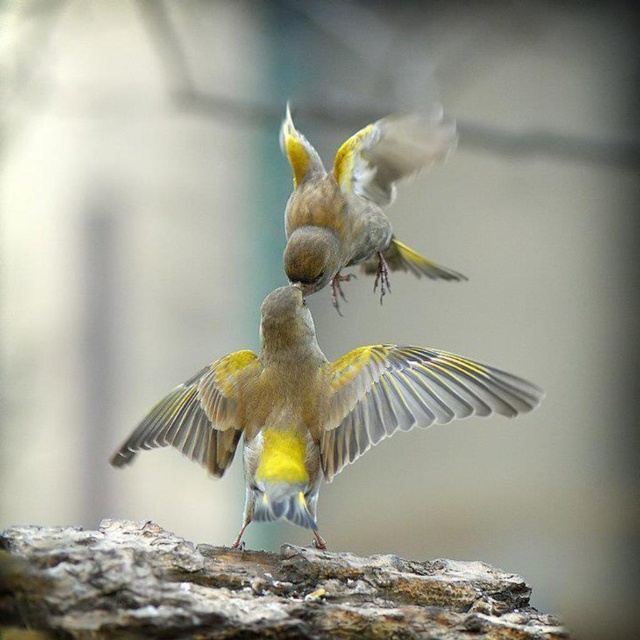
Question: Does yellow-green feathers at center appear on the right side of golden textured bird at center?

Choices:
 (A) no
 (B) yes

Answer: (A)

Question: Among these objects, which one is nearest to the camera?

Choices:
 (A) golden textured bird at center
 (B) yellow-green feathers at center

Answer: (B)

Question: Is yellow-green feathers at center thinner than golden textured bird at center?

Choices:
 (A) yes
 (B) no

Answer: (B)

Question: Among these points, which one is nearest to the camera?

Choices:
 (A) (387, 227)
 (B) (296, 388)

Answer: (B)

Question: Which object is farther from the camera taking this photo?

Choices:
 (A) yellow-green feathers at center
 (B) golden textured bird at center

Answer: (B)

Question: Can you confirm if yellow-green feathers at center is positioned to the left of golden textured bird at center?

Choices:
 (A) yes
 (B) no

Answer: (A)